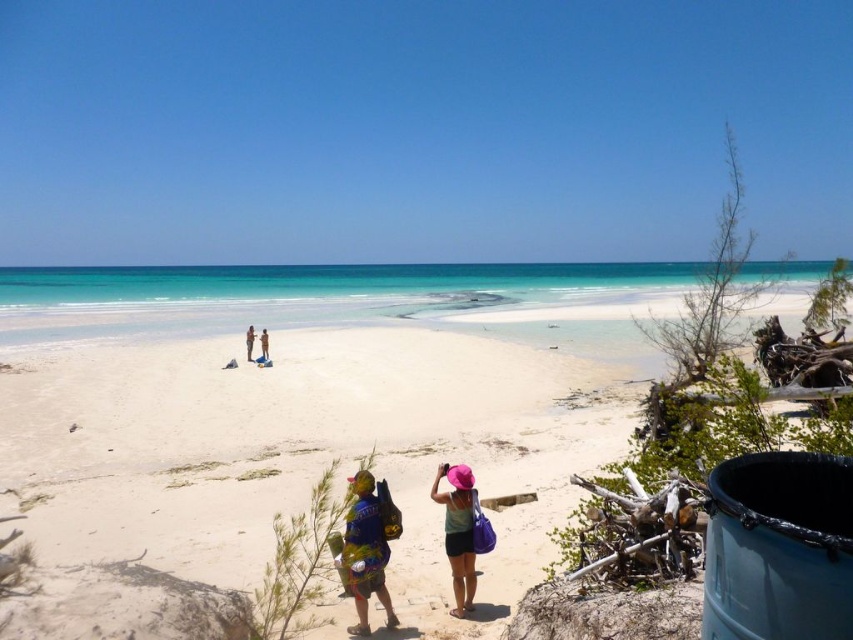
Question: Estimate the real-world distances between objects in this image. Which object is farther from the pink fabric hat at center?

Choices:
 (A) light brown sand at center
 (B) white sand beach at center
 (C) multicolored fabric backpack at lower center
 (D) light blue fabric at center

Answer: (D)

Question: Considering the real-world distances, which object is closest to the white sand beach at center?

Choices:
 (A) multicolored fabric backpack at lower center
 (B) light blue fabric at center
 (C) pink fabric hat at center

Answer: (B)

Question: Does multicolored fabric backpack at lower center appear under light brown sand at center?

Choices:
 (A) yes
 (B) no

Answer: (A)

Question: Is multicolored fabric backpack at lower center further to camera compared to pink fabric hat at center?

Choices:
 (A) no
 (B) yes

Answer: (A)

Question: Which point is closer to the camera?

Choices:
 (A) (465, 525)
 (B) (373, 515)
 (C) (247, 358)
 (D) (350, 358)

Answer: (B)

Question: Can you confirm if white sand beach at center is thinner than multicolored fabric backpack at lower center?

Choices:
 (A) no
 (B) yes

Answer: (A)